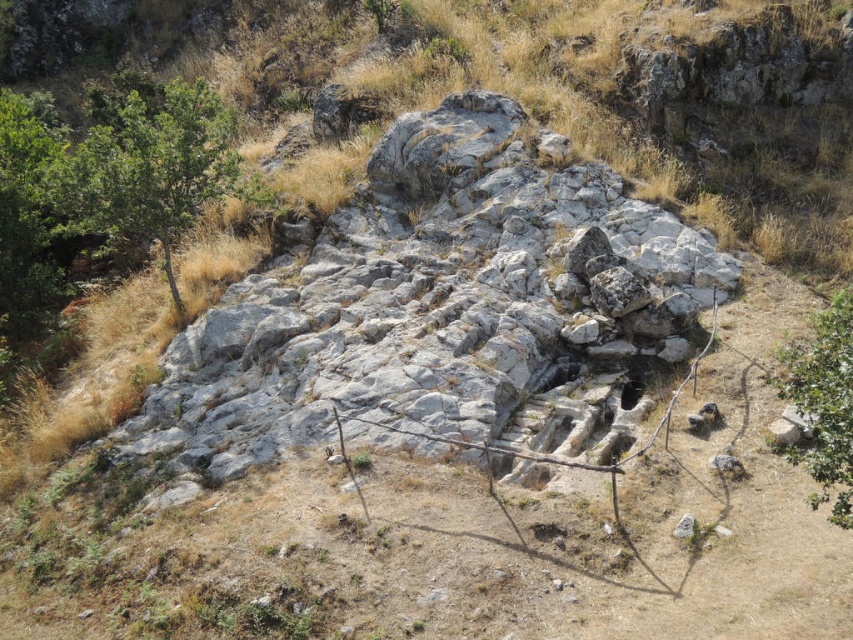
Question: Which point is farther to the camera?

Choices:
 (A) green leafy tree at lower right
 (B) green leafy tree at left

Answer: (B)

Question: Among these points, which one is farthest from the camera?

Choices:
 (A) (144, 140)
 (B) (831, 326)

Answer: (A)

Question: Does green leafy tree at left come behind green leafy tree at lower right?

Choices:
 (A) no
 (B) yes

Answer: (B)

Question: Is green leafy tree at left positioned in front of green leafy tree at lower right?

Choices:
 (A) yes
 (B) no

Answer: (B)

Question: Among these points, which one is nearest to the camera?

Choices:
 (A) (846, 296)
 (B) (157, 112)

Answer: (A)

Question: Does green leafy tree at left lie in front of green leafy tree at lower right?

Choices:
 (A) yes
 (B) no

Answer: (B)